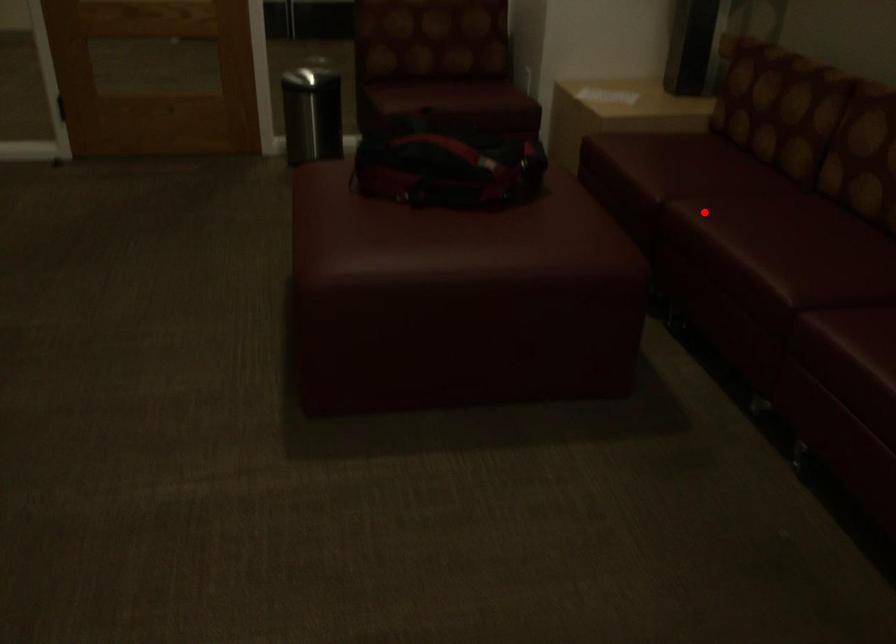
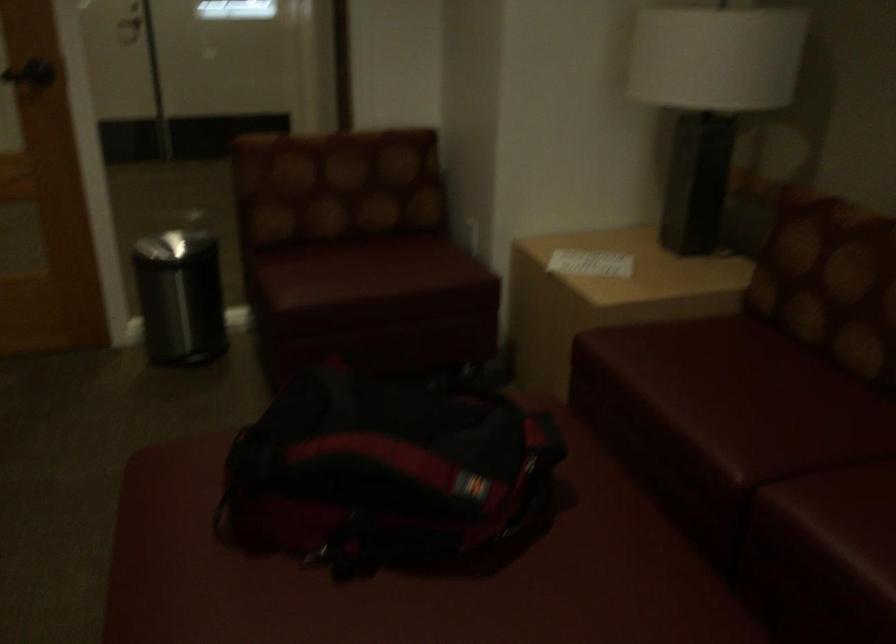
Question: A red point is marked in image1. In image2, is the corresponding 3D point closer to the camera or farther? Reply with the corresponding letter.

Choices:
 (A) The corresponding 3D point is closer.
 (B) The corresponding 3D point is farther.

Answer: (A)